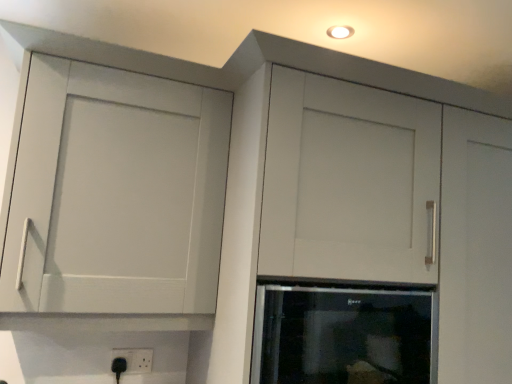
I want to click on matte white cupboard at upper left, so click(x=116, y=193).

This screenshot has width=512, height=384. Identify the location of matte white cupboard at upper left. (116, 193).

How much distance is there between black plastic electric outlet at lower center and black glass oven at center?

They are 75.91 centimeters apart.

This screenshot has height=384, width=512. I want to click on appliance in front of the black plastic electric outlet at lower center, so click(341, 336).

How different are the orientations of black plastic electric outlet at lower center and black glass oven at center in degrees?

black plastic electric outlet at lower center and black glass oven at center are facing 0.173 degrees away from each other.

Considering the sizes of black plastic electric outlet at lower center and black glass oven at center in the image, is black plastic electric outlet at lower center taller or shorter than black glass oven at center?

In the image, black plastic electric outlet at lower center appears to be shorter than black glass oven at center.

In terms of size, does black glass oven at center appear bigger or smaller than black plastic electric outlet at lower center?

Considering their sizes, black glass oven at center takes up more space than black plastic electric outlet at lower center.

Is black glass oven at center positioned in front of black plastic electric outlet at lower center?

Yes, black glass oven at center is closer to the viewer.

Can you tell me how much black glass oven at center and black plastic electric outlet at lower center differ in facing direction?

0.173 degrees separate the facing orientations of black glass oven at center and black plastic electric outlet at lower center.

Does point (333, 339) lie in front of point (135, 359)?

Yes, it is in front of point (135, 359).

From the image's perspective, is matte white cupboard at upper left positioned above or below black plastic electric outlet at lower center?

From the image's perspective, matte white cupboard at upper left appears above black plastic electric outlet at lower center.

Between matte white cupboard at upper left and black plastic electric outlet at lower center, which one appears on the left side from the viewer's perspective?

matte white cupboard at upper left.

Which of these two, matte white cupboard at upper left or black plastic electric outlet at lower center, stands shorter?

black plastic electric outlet at lower center is shorter.

Is matte white cupboard at upper left far from black plastic electric outlet at lower center?

That's not correct — matte white cupboard at upper left is a little close to black plastic electric outlet at lower center.

Is black glass oven at center not close to matte white cupboard at upper left?

No, black glass oven at center is not far from matte white cupboard at upper left.

From the image's perspective, would you say black glass oven at center is positioned over matte white cupboard at upper left?

No, from the image's perspective, black glass oven at center is not on top of matte white cupboard at upper left.

Is black glass oven at center not within matte white cupboard at upper left?

black glass oven at center is positioned outside matte white cupboard at upper left.

At what (x,y) coordinates should I click in order to perform the action: click on appliance on the right of matte white cupboard at upper left. Please return your answer as a coordinate pair (x, y). This screenshot has width=512, height=384. Looking at the image, I should click on (341, 336).

Can you confirm if matte white cupboard at upper left is bigger than black glass oven at center?

Correct, matte white cupboard at upper left is larger in size than black glass oven at center.

From a real-world perspective, is matte white cupboard at upper left positioned above or below black glass oven at center?

From a real-world perspective, matte white cupboard at upper left is physically above black glass oven at center.

Is matte white cupboard at upper left not close to black glass oven at center?

No, matte white cupboard at upper left is not far from black glass oven at center.

Which is farther, (125, 349) or (108, 72)?

The point (125, 349) is more distant.

Are black plastic electric outlet at lower center and matte white cupboard at upper left far apart?

No, black plastic electric outlet at lower center is in close proximity to matte white cupboard at upper left.

You are a GUI agent. You are given a task and a screenshot of the screen. Output one action in this format:
    pyautogui.click(x=<x>, y=<y>)
    Task: Click on the electric outlet below the black glass oven at center (from a real-world perspective)
    Image resolution: width=512 pixels, height=384 pixels.
    Given the screenshot: What is the action you would take?
    pyautogui.click(x=135, y=359)

I want to click on electric outlet lying behind the black glass oven at center, so click(x=135, y=359).

When comparing their distances from matte white cupboard at upper left, does black glass oven at center or black plastic electric outlet at lower center seem further?

Among the two, black plastic electric outlet at lower center is located further to matte white cupboard at upper left.

Estimate the real-world distances between objects in this image. Which object is further from black plastic electric outlet at lower center, matte white cupboard at upper left or black glass oven at center?

black glass oven at center is positioned further to the anchor black plastic electric outlet at lower center.

Looking at the image, which one is located further to black glass oven at center, black plastic electric outlet at lower center or matte white cupboard at upper left?

black plastic electric outlet at lower center lies further to black glass oven at center than the other object.

Looking at the image, which one is located further to black glass oven at center, matte white cupboard at upper left or black plastic electric outlet at lower center?

black plastic electric outlet at lower center is positioned further to the anchor black glass oven at center.

Which object lies nearer to the anchor point black plastic electric outlet at lower center, black glass oven at center or matte white cupboard at upper left?

The object closer to black plastic electric outlet at lower center is matte white cupboard at upper left.

Estimate the real-world distances between objects in this image. Which object is further from matte white cupboard at upper left, black plastic electric outlet at lower center or black glass oven at center?

Based on the image, black plastic electric outlet at lower center appears to be further to matte white cupboard at upper left.

Where is `electric outlet between matte white cupboard at upper left and black glass oven at center in the horizontal direction`? The width and height of the screenshot is (512, 384). electric outlet between matte white cupboard at upper left and black glass oven at center in the horizontal direction is located at coordinates (135, 359).